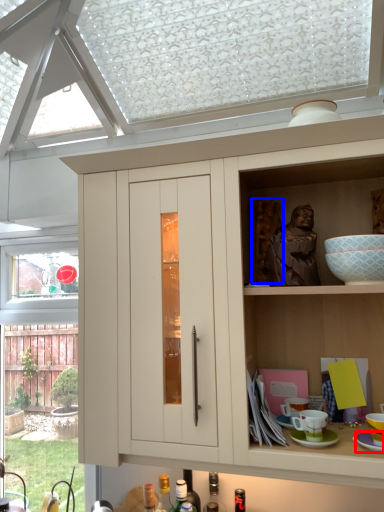
Question: Which of the following is the farthest to the observer, saucer (highlighted by a red box) or sculpture (highlighted by a blue box)?

Choices:
 (A) saucer
 (B) sculpture

Answer: (B)